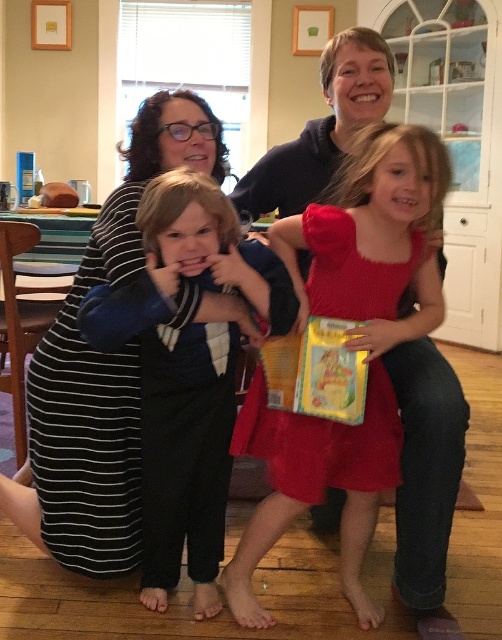
What are the coordinates of the blue cotton shirt at center?

The coordinates of the blue cotton shirt at center are at point [187,371].

You are a photographer setting up a shoot in this family kitchen scene. You need to position a backdrop behind the two central figures wearing the blue cotton shirt at center and the red matte dress at center. Since the backdrop is only tall enough to cover up to the height of the shorter figure, which figure will the backdrop fully cover?

The backdrop will fully cover the red matte dress at center because the blue cotton shirt at center is much taller than the red matte dress at center, making the dress the shorter figure.